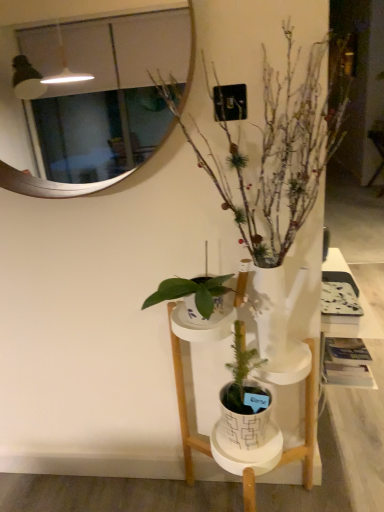
Describe the element at coordinates (184, 407) in the screenshot. This screenshot has width=384, height=512. I see `white ceramic pot at center` at that location.

Where is `white matte vase at center`? white matte vase at center is located at coordinates (278, 144).

You are a GUI agent. You are given a task and a screenshot of the screen. Output one action in this format:
    pyautogui.click(x=<x>, y=<y>)
    Task: Click on the white ceramic pot at center
    This screenshot has height=512, width=384.
    Given the screenshot: What is the action you would take?
    pyautogui.click(x=184, y=407)

Does white ceramic pot at center have a smaller size compared to white matte vase at center?

Actually, white ceramic pot at center might be larger than white matte vase at center.

From a real-world perspective, is white ceramic pot at center positioned above or below white matte vase at center?

In terms of real-world spatial position, white ceramic pot at center is below white matte vase at center.

Is white ceramic pot at center far from white matte vase at center?

That's not correct — white ceramic pot at center is a little close to white matte vase at center.

Considering their positions, is white glossy mirror at upper center located in front of or behind white matte vase at center?

Visually, white glossy mirror at upper center is located behind white matte vase at center.

Between white glossy mirror at upper center and white matte vase at center, which one has smaller width?

white glossy mirror at upper center.

Is white glossy mirror at upper center spatially inside white matte vase at center, or outside of it?

white glossy mirror at upper center cannot be found inside white matte vase at center.

Considering the relative sizes of white glossy mirror at upper center and white matte vase at center in the image provided, is white glossy mirror at upper center shorter than white matte vase at center?

Yes.

Where is `furniture in front of the white glossy mirror at upper center`? This screenshot has height=512, width=384. furniture in front of the white glossy mirror at upper center is located at coordinates (184, 407).

Is white glossy mirror at upper center shorter than white ceramic pot at center?

Indeed, white glossy mirror at upper center has a lesser height compared to white ceramic pot at center.

Is white glossy mirror at upper center far away from white ceramic pot at center?

They are positioned close to each other.

Based on the photo, considering the relative sizes of white matte vase at center and white glossy mirror at upper center in the image provided, is white matte vase at center smaller than white glossy mirror at upper center?

No.

From a real-world perspective, which is physically above, white matte vase at center or white glossy mirror at upper center?

In real-world perspective, white glossy mirror at upper center is above.

From the image's perspective, is white matte vase at center positioned above or below white glossy mirror at upper center?

Based on their image positions, white matte vase at center is located beneath white glossy mirror at upper center.

Is white matte vase at center placed right next to white glossy mirror at upper center?

white matte vase at center and white glossy mirror at upper center are not in contact.

Is white ceramic pot at center taller than white glossy mirror at upper center?

Yes, white ceramic pot at center is taller than white glossy mirror at upper center.

Which of these two, white ceramic pot at center or white glossy mirror at upper center, is bigger?

With larger size is white ceramic pot at center.

Would you say white ceramic pot at center is inside or outside white glossy mirror at upper center?

white ceramic pot at center is not inside white glossy mirror at upper center, it's outside.

Could you tell me if white ceramic pot at center is turned towards white glossy mirror at upper center?

No, white ceramic pot at center is not aimed at white glossy mirror at upper center.

From a real-world perspective, between white matte vase at center and white ceramic pot at center, who is vertically lower?

white ceramic pot at center is physically lower.

From the picture: Are white matte vase at center and white ceramic pot at center making contact?

No.

Image resolution: width=384 pixels, height=512 pixels. I want to click on furniture behind the white matte vase at center, so click(184, 407).

Consider the image. Is white matte vase at center looking in the opposite direction of white ceramic pot at center?

white matte vase at center does not have its back to white ceramic pot at center.

You are a GUI agent. You are given a task and a screenshot of the screen. Output one action in this format:
    pyautogui.click(x=<x>, y=<y>)
    Task: Click on the houseplant above the white ceramic pot at center (from the image's perspective)
    This screenshot has width=384, height=512.
    Given the screenshot: What is the action you would take?
    pyautogui.click(x=278, y=144)

You are a GUI agent. You are given a task and a screenshot of the screen. Output one action in this format:
    pyautogui.click(x=<x>, y=<y>)
    Task: Click on the mirror on the left of white matte vase at center
    This screenshot has width=384, height=512.
    Given the screenshot: What is the action you would take?
    pyautogui.click(x=50, y=184)

Considering their positions, is white glossy mirror at upper center positioned further to white ceramic pot at center than white matte vase at center?

white glossy mirror at upper center.

Which object lies further to the anchor point white matte vase at center, white ceramic pot at center or white glossy mirror at upper center?

Based on the image, white ceramic pot at center appears to be further to white matte vase at center.

Based on their spatial positions, is white ceramic pot at center or white matte vase at center closer to white glossy mirror at upper center?

The object closer to white glossy mirror at upper center is white matte vase at center.

Considering their positions, is white matte vase at center positioned closer to white glossy mirror at upper center than white ceramic pot at center?

white matte vase at center is closer to white glossy mirror at upper center.

Based on their spatial positions, is white glossy mirror at upper center or white ceramic pot at center further from white matte vase at center?

white ceramic pot at center is further to white matte vase at center.

Consider the image. Based on their spatial positions, is white matte vase at center or white glossy mirror at upper center further from white ceramic pot at center?

Among the two, white glossy mirror at upper center is located further to white ceramic pot at center.

Identify the location of houseplant between white glossy mirror at upper center and white ceramic pot at center in the vertical direction. This screenshot has height=512, width=384. (278, 144).